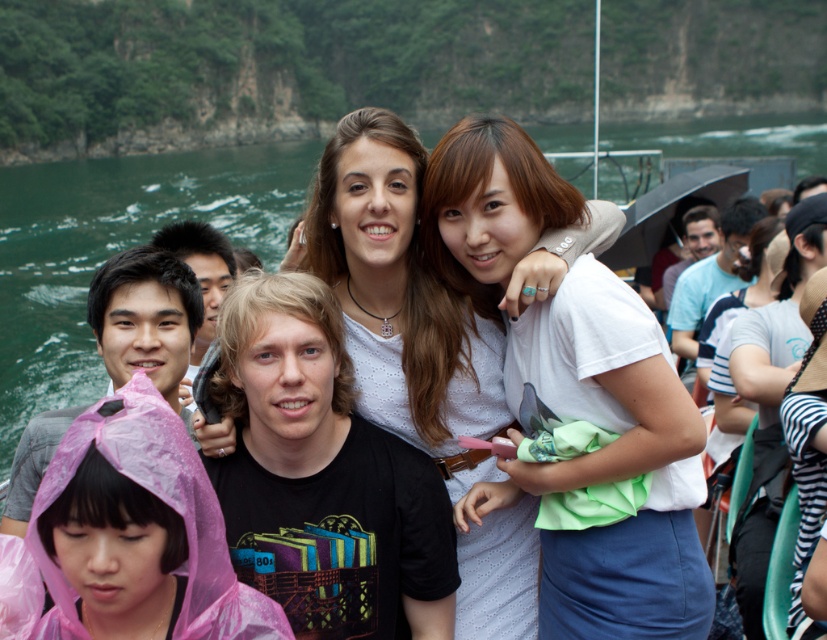
Question: Is green water at center positioned before pink plastic raincoat at lower left?

Choices:
 (A) no
 (B) yes

Answer: (A)

Question: Is white cotton shirt at center positioned at the back of green water at center?

Choices:
 (A) no
 (B) yes

Answer: (A)

Question: Which point is closer to the camera?

Choices:
 (A) (123, 289)
 (B) (48, 499)

Answer: (B)

Question: Can you confirm if pink plastic raincoat at lower left is wider than pink raincoat at lower left?

Choices:
 (A) yes
 (B) no

Answer: (A)

Question: Which object is closer to the camera taking this photo?

Choices:
 (A) pink plastic raincoat at lower left
 (B) green water at center
 (C) white cotton shirt at center
 (D) pink raincoat at lower left

Answer: (A)

Question: Which object is positioned closest to the black matte t-shirt at center?

Choices:
 (A) pink raincoat at lower left
 (B) green water at center
 (C) pink plastic raincoat at lower left

Answer: (C)